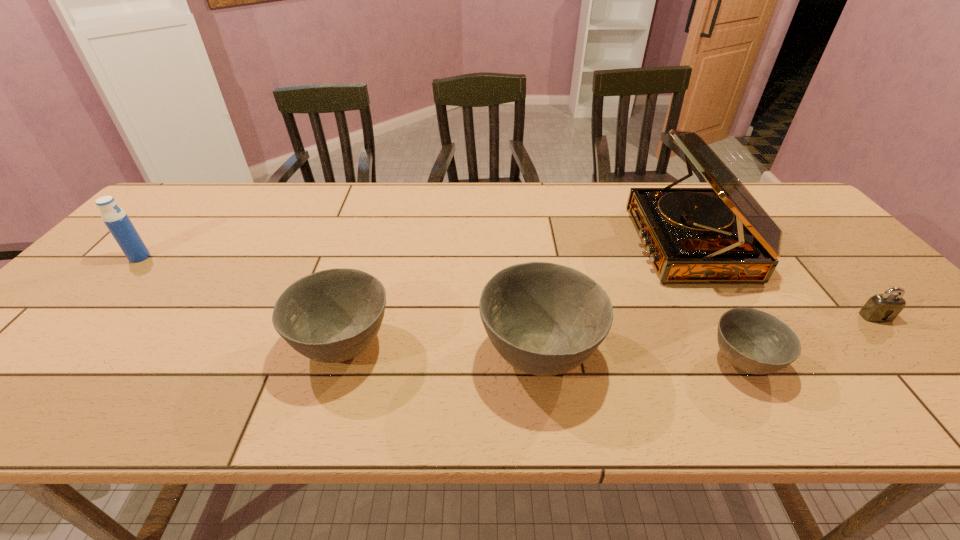
Find the location of a particular element. This screenshot has height=540, width=960. the leftmost bowl is located at coordinates (x=333, y=315).

This screenshot has height=540, width=960. I want to click on the fourth tallest object, so click(x=333, y=315).

Locate an element on the screen. The image size is (960, 540). the second bowl from left to right is located at coordinates (545, 319).

At what (x,y) coordinates should I click in order to perform the action: click on the shortest bowl. Please return your answer as a coordinate pair (x, y). Image resolution: width=960 pixels, height=540 pixels. Looking at the image, I should click on (756, 342).

You are a GUI agent. You are given a task and a screenshot of the screen. Output one action in this format:
    pyautogui.click(x=<x>, y=<y>)
    Task: Click on the padlock
    This screenshot has width=960, height=540.
    Given the screenshot: What is the action you would take?
    pyautogui.click(x=880, y=308)

Where is `record player`? The height and width of the screenshot is (540, 960). record player is located at coordinates (722, 234).

Locate an element on the screen. Image resolution: width=960 pixels, height=540 pixels. the leftmost object is located at coordinates (115, 218).

Identify the location of water bottle. The image size is (960, 540). (115, 218).

This screenshot has width=960, height=540. I want to click on vacant space positioned 0.070m on the back of the third shortest object, so click(x=360, y=289).

This screenshot has width=960, height=540. Find the location of `vacant region located on the left of the third object from left to right`. vacant region located on the left of the third object from left to right is located at coordinates (350, 353).